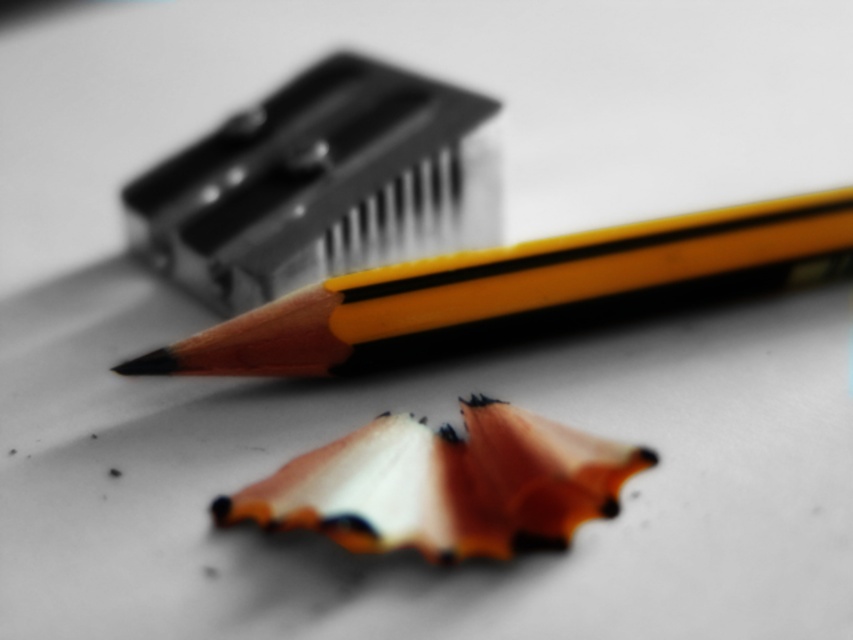
Does wooden pencil at center appear on the right side of orange wood pencil at center?

Indeed, wooden pencil at center is positioned on the right side of orange wood pencil at center.

Does wooden pencil at center have a lesser height compared to orange wood pencil at center?

Incorrect, wooden pencil at center's height does not fall short of orange wood pencil at center's.

Is point (761, 262) more distant than point (469, 502)?

Yes, point (761, 262) is farther from viewer.

This screenshot has width=853, height=640. In order to click on wooden pencil at center in this screenshot , I will do point(502,284).

Who is positioned more to the left, matte yellow pencil at upper center or orange wood pencil at center?

matte yellow pencil at upper center is more to the left.

Which of these two, matte yellow pencil at upper center or orange wood pencil at center, stands shorter?

Standing shorter between the two is orange wood pencil at center.

Does point (253, 154) lie behind point (379, 502)?

Yes.

Locate an element on the screen. The height and width of the screenshot is (640, 853). matte yellow pencil at upper center is located at coordinates (318, 186).

Which is in front, point (374, 173) or point (527, 257)?

Point (527, 257) is more forward.

Is matte yellow pencil at upper center to the left of wooden pencil at center from the viewer's perspective?

Yes, matte yellow pencil at upper center is to the left of wooden pencil at center.

Which is behind, point (316, 268) or point (645, 284)?

Point (316, 268)

Locate an element on the screen. matte yellow pencil at upper center is located at coordinates (318, 186).